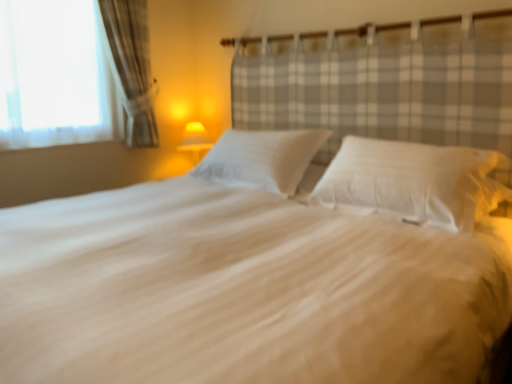
Question: Is yellow fabric lampshade at center located within white soft pillow at center, positioned as the first pillow in left-to-right order?

Choices:
 (A) no
 (B) yes

Answer: (A)

Question: Is white soft pillow at center, the second pillow from the right, positioned beyond the bounds of yellow fabric lampshade at center?

Choices:
 (A) yes
 (B) no

Answer: (A)

Question: From the image's perspective, is white soft pillow at center, the second pillow from the right, below yellow fabric lampshade at center?

Choices:
 (A) yes
 (B) no

Answer: (A)

Question: From the image's perspective, is white soft pillow at center, the second pillow from the right, located above yellow fabric lampshade at center?

Choices:
 (A) no
 (B) yes

Answer: (A)

Question: Can you confirm if white soft pillow at center, positioned as the first pillow in left-to-right order, is thinner than yellow fabric lampshade at center?

Choices:
 (A) yes
 (B) no

Answer: (B)

Question: Relative to white soft pillow at center, marked as the 2th pillow in a left-to-right arrangement, is yellow fabric lampshade at center in front or behind?

Choices:
 (A) front
 (B) behind

Answer: (B)

Question: From the image's perspective, is yellow fabric lampshade at center positioned above or below white soft pillow at center, marked as the 2th pillow in a left-to-right arrangement?

Choices:
 (A) above
 (B) below

Answer: (A)

Question: Is yellow fabric lampshade at center to the left or to the right of white soft pillow at center, marked as the 2th pillow in a left-to-right arrangement, in the image?

Choices:
 (A) right
 (B) left

Answer: (B)

Question: In terms of width, does yellow fabric lampshade at center look wider or thinner when compared to white soft pillow at center, the 1th pillow from the right?

Choices:
 (A) thin
 (B) wide

Answer: (A)

Question: In terms of size, does white soft bed at center appear bigger or smaller than white soft pillow at center, the 1th pillow from the right?

Choices:
 (A) big
 (B) small

Answer: (A)

Question: Would you say white soft bed at center is inside or outside white soft pillow at center, marked as the 2th pillow in a left-to-right arrangement?

Choices:
 (A) outside
 (B) inside

Answer: (A)

Question: In the image, is white soft bed at center positioned in front of or behind white soft pillow at center, marked as the 2th pillow in a left-to-right arrangement?

Choices:
 (A) behind
 (B) front

Answer: (B)

Question: From the image's perspective, is white soft bed at center above or below white soft pillow at center, the 1th pillow from the right?

Choices:
 (A) below
 (B) above

Answer: (A)

Question: Considering the positions of yellow fabric lampshade at center and white soft bed at center in the image, is yellow fabric lampshade at center bigger or smaller than white soft bed at center?

Choices:
 (A) big
 (B) small

Answer: (B)

Question: From a real-world perspective, is yellow fabric lampshade at center positioned above or below white soft bed at center?

Choices:
 (A) above
 (B) below

Answer: (A)